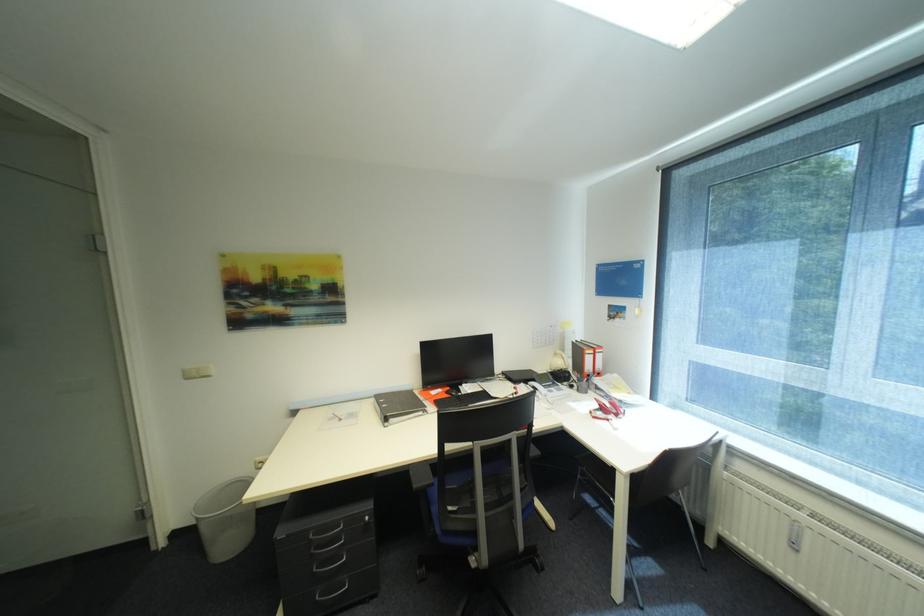
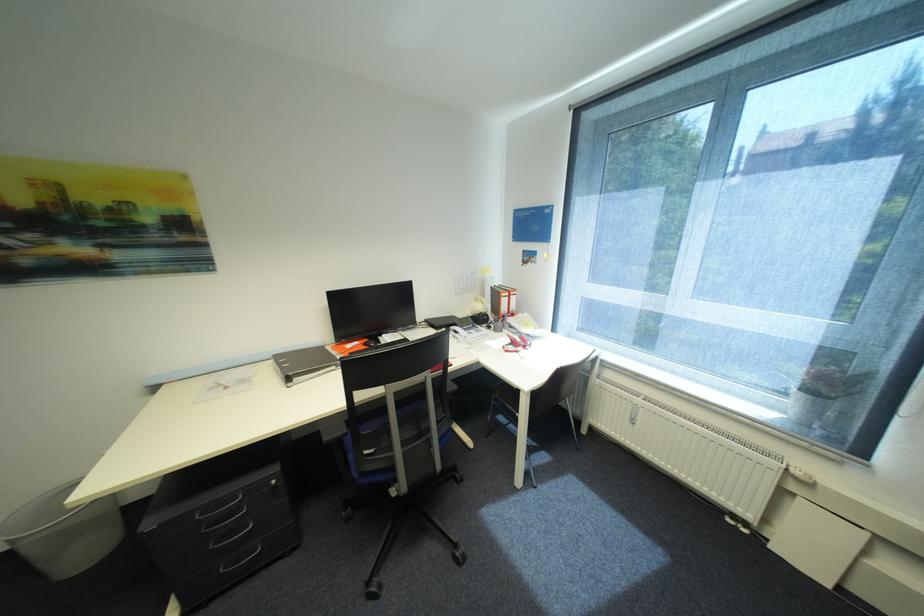
In the second image, find the point that corresponds to (201,524) in the first image.

(14, 548)